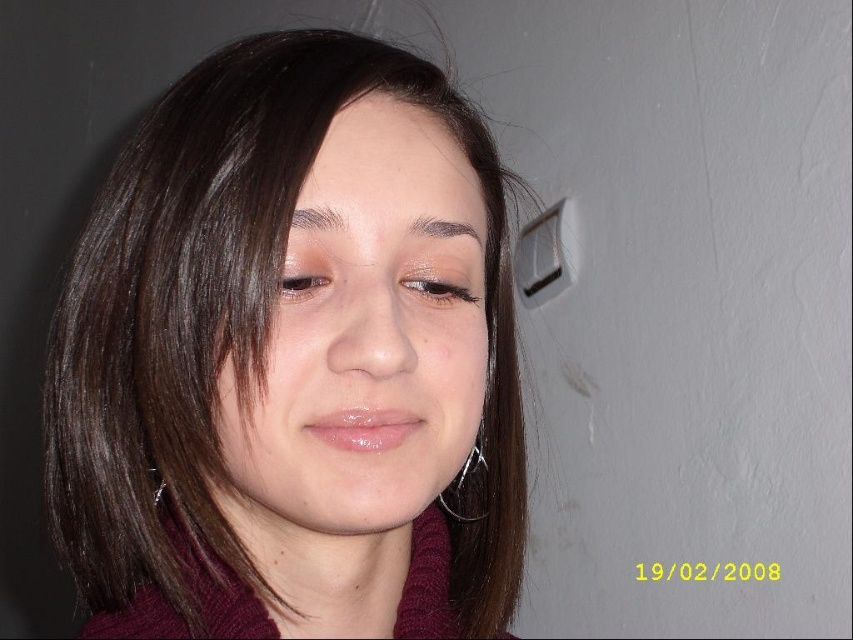
Question: Considering the real-world distances, which object is closest to the dark brown eyebrow at upper center?

Choices:
 (A) dark brown hair at upper center
 (B) brown matte hair at center
 (C) brown glossy eye at upper left
 (D) smooth skin face at center

Answer: (A)

Question: Can you confirm if brown glossy eye at upper left is positioned above dark brown hair at upper center?

Choices:
 (A) yes
 (B) no

Answer: (B)

Question: Which of the following is the farthest from the observer?

Choices:
 (A) (439, 228)
 (B) (426, 268)
 (C) (195, 248)

Answer: (B)

Question: Does brown matte hair at center appear over dark brown eyebrow at upper center?

Choices:
 (A) no
 (B) yes

Answer: (A)

Question: Among these points, which one is farthest from the camera?

Choices:
 (A) (477, 296)
 (B) (260, 460)

Answer: (A)

Question: Is brown matte hair at center above matte brown eye at center?

Choices:
 (A) no
 (B) yes

Answer: (A)